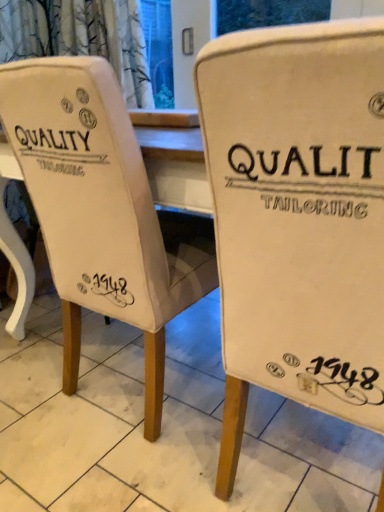
Find the location of a particular element. The height and width of the screenshot is (512, 384). vacant space in beige fabric chair at center, the first chair from the right (from a real-world perspective) is located at coordinates (299, 458).